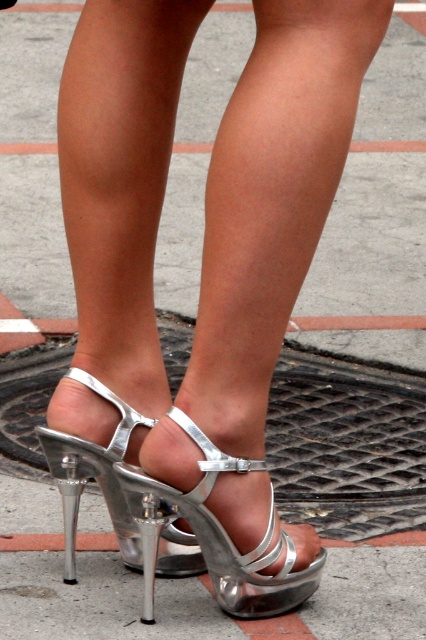
Question: Among these points, which one is nearest to the camera?

Choices:
 (A) (178, 550)
 (B) (74, 579)
 (C) (172, 416)

Answer: (C)

Question: Considering the relative positions of shiny metallic sandal at lower center and shiny metallic heel at center in the image provided, where is shiny metallic sandal at lower center located with respect to shiny metallic heel at center?

Choices:
 (A) right
 (B) left

Answer: (A)

Question: Does shiny metallic high-heeled shoe at center have a smaller size compared to shiny metallic heel at center?

Choices:
 (A) no
 (B) yes

Answer: (A)

Question: Among these points, which one is nearest to the camera?

Choices:
 (A) (164, 573)
 (B) (65, 573)
 (C) (284, 588)

Answer: (C)

Question: Is shiny metallic sandal at lower center wider than shiny metallic heel at center?

Choices:
 (A) yes
 (B) no

Answer: (A)

Question: Which of these objects is positioned farthest from the shiny metallic high-heeled shoe at center?

Choices:
 (A) shiny metallic sandal at lower center
 (B) shiny metallic heel at center

Answer: (B)